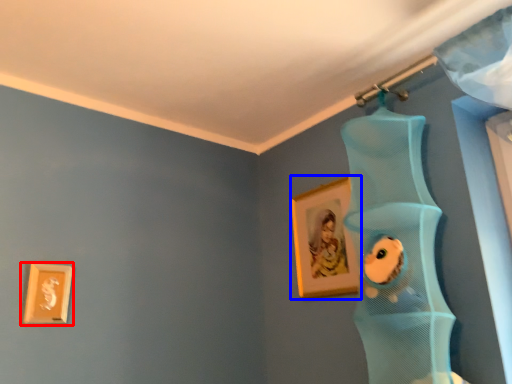
Question: Which point is further to the camera, picture frame (highlighted by a red box) or picture frame (highlighted by a blue box)?

Choices:
 (A) picture frame
 (B) picture frame

Answer: (B)